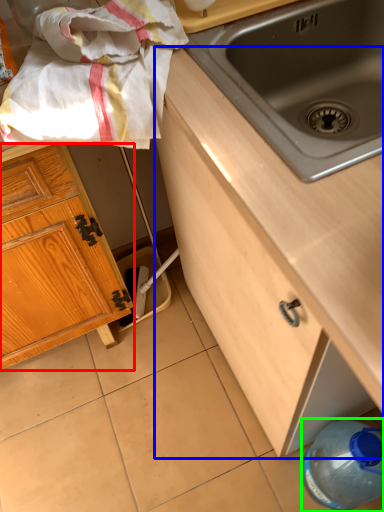
Question: Based on their relative distances, which object is nearer to cabinetry (highlighted by a red box)? Choose from cabinetry (highlighted by a blue box) and bottle (highlighted by a green box).

Choices:
 (A) cabinetry
 (B) bottle

Answer: (A)